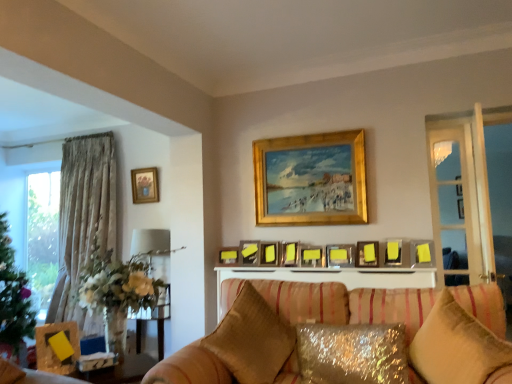
Question: Considering the relative sizes of yellow matte picture frame at upper center, placed as the first picture frame when sorted from right to left, and gold-framed picture at upper left, which appears as the 1th picture frame when viewed from the left, in the image provided, is yellow matte picture frame at upper center, placed as the first picture frame when sorted from right to left, wider than gold-framed picture at upper left, which appears as the 1th picture frame when viewed from the left,?

Choices:
 (A) yes
 (B) no

Answer: (A)

Question: Is yellow matte picture frame at upper center, arranged as the 2th picture frame when viewed from the front, oriented away from gold-framed picture at upper left, marked as the twelfth picture frame in a right-to-left arrangement?

Choices:
 (A) no
 (B) yes

Answer: (A)

Question: Is yellow matte picture frame at upper center, placed as the first picture frame when sorted from right to left, positioned before gold-framed picture at upper left, acting as the 1th picture frame starting from the back?

Choices:
 (A) yes
 (B) no

Answer: (A)

Question: Does yellow matte picture frame at upper center, arranged as the 2th picture frame when viewed from the front, contain gold-framed picture at upper left, acting as the 1th picture frame starting from the back?

Choices:
 (A) no
 (B) yes

Answer: (A)

Question: Does yellow matte picture frame at upper center, the 12th picture frame positioned from the left, touch gold-framed picture at upper left, which appears as the 12th picture frame when viewed from the front?

Choices:
 (A) no
 (B) yes

Answer: (A)

Question: Would you say satin gold pillow at lower center, which is counted as the first pillow, starting from the left, is inside or outside gold-framed picture at upper left, marked as the twelfth picture frame in a right-to-left arrangement?

Choices:
 (A) inside
 (B) outside

Answer: (B)

Question: From a real-world perspective, is satin gold pillow at lower center, which is counted as the first pillow, starting from the left, positioned above or below gold-framed picture at upper left, marked as the twelfth picture frame in a right-to-left arrangement?

Choices:
 (A) below
 (B) above

Answer: (A)

Question: In the image, is satin gold pillow at lower center, marked as the third pillow in a right-to-left arrangement, on the left side or the right side of gold-framed picture at upper left, acting as the 1th picture frame starting from the back?

Choices:
 (A) left
 (B) right

Answer: (B)

Question: Based on their sizes in the image, would you say satin gold pillow at lower center, which is counted as the first pillow, starting from the left, is bigger or smaller than gold-framed picture at upper left, acting as the 1th picture frame starting from the back?

Choices:
 (A) small
 (B) big

Answer: (B)

Question: Would you say metallic silver picture frame at center, which is the 7th picture frame in front-to-back order, is to the left or to the right of metallic silver picture frame at center, the 6th picture frame when ordered from left to right, in the picture?

Choices:
 (A) left
 (B) right

Answer: (B)

Question: Relative to metallic silver picture frame at center, the eighth picture frame viewed from the front, is metallic silver picture frame at center, which is the 7th picture frame in front-to-back order, in front or behind?

Choices:
 (A) front
 (B) behind

Answer: (A)

Question: Does point (306, 263) appear closer or farther from the camera than point (293, 259)?

Choices:
 (A) farther
 (B) closer

Answer: (B)

Question: Considering the positions of metallic silver picture frame at center, which is the 5th picture frame in right-to-left order, and metallic silver picture frame at center, the eighth picture frame viewed from the front, in the image, is metallic silver picture frame at center, which is the 5th picture frame in right-to-left order, wider or thinner than metallic silver picture frame at center, the eighth picture frame viewed from the front,?

Choices:
 (A) wide
 (B) thin

Answer: (B)

Question: Based on their sizes in the image, would you say wooden picture frame at left, the 2th picture frame positioned from the left, is bigger or smaller than yellow matte picture frame at center, the 3th picture frame from the front?

Choices:
 (A) big
 (B) small

Answer: (A)

Question: Do you think wooden picture frame at left, the 2th picture frame positioned from the left, is within yellow matte picture frame at center, which is counted as the 11th picture frame, starting from the left, or outside of it?

Choices:
 (A) inside
 (B) outside

Answer: (B)